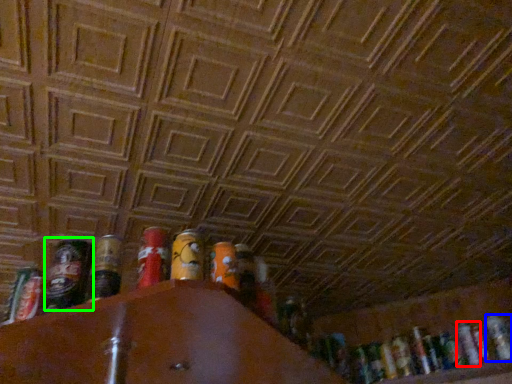
Question: Estimate the real-world distances between objects in this image. Which object is farther from beer (highlighted by a red box), beer (highlighted by a blue box) or beer (highlighted by a green box)?

Choices:
 (A) beer
 (B) beer

Answer: (B)